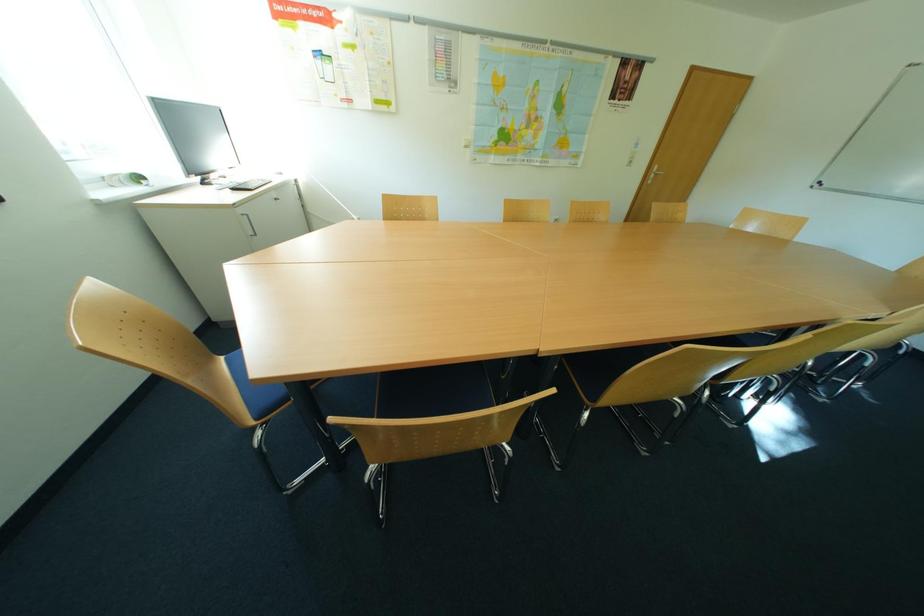
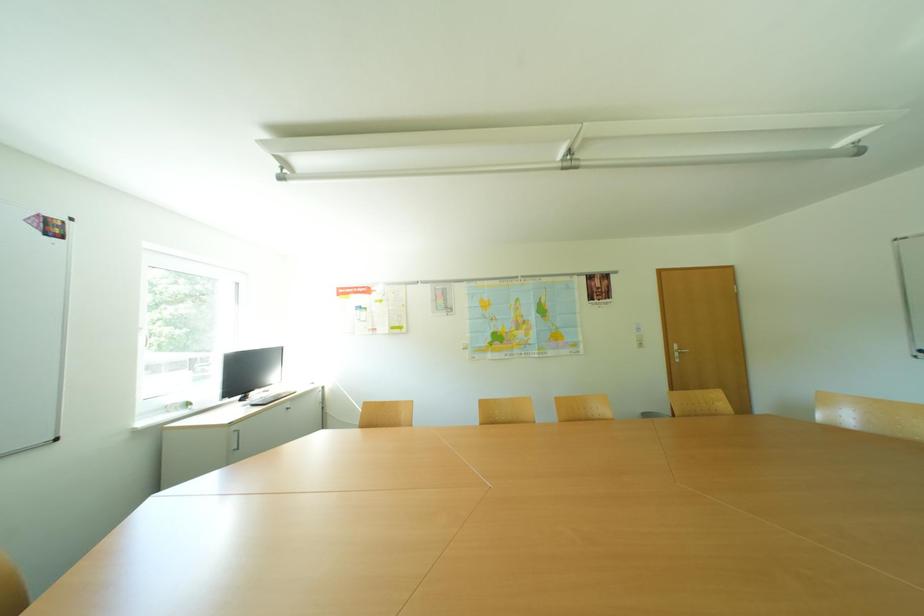
First-person continuous shooting, in which direction is the camera rotating?

The camera rotated toward left-up.